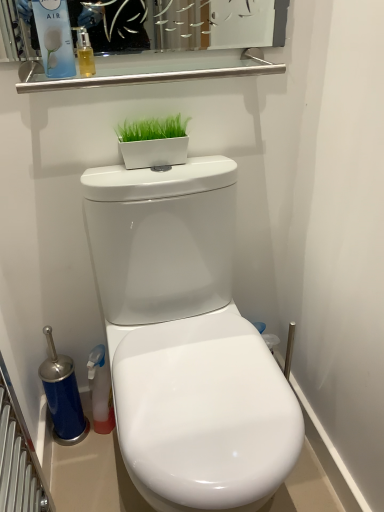
The height and width of the screenshot is (512, 384). What do you see at coordinates (86, 61) in the screenshot?
I see `translucent amber liquid at upper left` at bounding box center [86, 61].

The height and width of the screenshot is (512, 384). What are the coordinates of `satin nickel bar at upper center` in the screenshot? It's located at (152, 69).

Which is more to the left, white glossy toilet at center or white glossy flowerpot at upper center?

white glossy flowerpot at upper center.

Locate an element on the screen. The image size is (384, 512). toilet that appears below the white glossy flowerpot at upper center (from the image's perspective) is located at coordinates (186, 340).

In terms of height, does white glossy toilet at center look taller or shorter compared to white glossy flowerpot at upper center?

Considering their sizes, white glossy toilet at center has more height than white glossy flowerpot at upper center.

In the scene shown: Does white glossy toilet at center have a lesser width compared to translucent amber liquid at upper left?

No.

Does point (292, 452) come in front of point (83, 57)?

Yes, point (292, 452) is closer to viewer.

You are a GUI agent. You are given a task and a screenshot of the screen. Output one action in this format:
    pyautogui.click(x=<x>, y=<y>)
    Task: Click on the liquid above the white glossy toilet at center (from a real-world perspective)
    The height and width of the screenshot is (512, 384).
    Given the screenshot: What is the action you would take?
    pyautogui.click(x=86, y=61)

Considering the positions of objects white glossy toilet at center and translucent amber liquid at upper left in the image provided, who is in front, white glossy toilet at center or translucent amber liquid at upper left?

Positioned in front is white glossy toilet at center.

Which is in front, point (156, 159) or point (50, 73)?

The point (50, 73) is in front.

Is white glossy flowerpot at upper center next to matte blue air freshener at upper left and touching it?

No, white glossy flowerpot at upper center is not touching matte blue air freshener at upper left.

Considering the sizes of objects white glossy flowerpot at upper center and matte blue air freshener at upper left in the image provided, who is smaller, white glossy flowerpot at upper center or matte blue air freshener at upper left?

white glossy flowerpot at upper center.

From a real-world perspective, is matte blue air freshener at upper left located higher than white glossy flowerpot at upper center?

Correct, in the physical world, matte blue air freshener at upper left is higher than white glossy flowerpot at upper center.

Who is bigger, matte blue air freshener at upper left or white glossy flowerpot at upper center?

matte blue air freshener at upper left is bigger.

Is matte blue air freshener at upper left completely or partially outside of white glossy flowerpot at upper center?

Yes.

Considering the sizes of objects white glossy flowerpot at upper center and white glossy toilet at center in the image provided, who is smaller, white glossy flowerpot at upper center or white glossy toilet at center?

white glossy flowerpot at upper center.

Based on the photo, from the image's perspective, is white glossy flowerpot at upper center above or below white glossy toilet at center?

Based on their image positions, white glossy flowerpot at upper center is located above white glossy toilet at center.

Is white glossy flowerpot at upper center in contact with white glossy toilet at center?

They are not placed beside each other.

Considering the positions of objects white glossy flowerpot at upper center and white glossy toilet at center in the image provided, who is behind, white glossy flowerpot at upper center or white glossy toilet at center?

white glossy flowerpot at upper center is more distant.

Can you confirm if matte blue air freshener at upper left is positioned to the left of satin nickel bar at upper center?

Yes, matte blue air freshener at upper left is to the left of satin nickel bar at upper center.

Where is `balustrade directly beneath the matte blue air freshener at upper left (from a real-world perspective)`? The width and height of the screenshot is (384, 512). balustrade directly beneath the matte blue air freshener at upper left (from a real-world perspective) is located at coordinates (152, 69).

Can you confirm if matte blue air freshener at upper left is taller than satin nickel bar at upper center?

Yes.

Between satin nickel bar at upper center and translucent amber liquid at upper left, which one has smaller width?

translucent amber liquid at upper left.

Which object is positioned more to the left, satin nickel bar at upper center or translucent amber liquid at upper left?

Positioned to the left is translucent amber liquid at upper left.

Considering the relative sizes of satin nickel bar at upper center and translucent amber liquid at upper left in the image provided, is satin nickel bar at upper center taller than translucent amber liquid at upper left?

No.

Is point (191, 62) positioned before point (86, 73)?

No, (191, 62) is behind (86, 73).

In order to click on toilet in front of the white glossy flowerpot at upper center in this screenshot , I will do tap(186, 340).

The image size is (384, 512). Find the location of `liquid behind the white glossy toilet at center`. liquid behind the white glossy toilet at center is located at coordinates (86, 61).

Which object lies nearer to the anchor point white glossy flowerpot at upper center, translucent amber liquid at upper left or satin nickel bar at upper center?

Based on the image, satin nickel bar at upper center appears to be nearer to white glossy flowerpot at upper center.

From the image, which object appears to be nearer to white glossy flowerpot at upper center, satin nickel bar at upper center or white glossy toilet at center?

satin nickel bar at upper center is closer to white glossy flowerpot at upper center.

Looking at the image, which one is located closer to white glossy toilet at center, matte blue air freshener at upper left or satin nickel bar at upper center?

Among the two, satin nickel bar at upper center is located nearer to white glossy toilet at center.

Which object lies further to the anchor point satin nickel bar at upper center, matte blue air freshener at upper left or translucent amber liquid at upper left?

Among the two, matte blue air freshener at upper left is located further to satin nickel bar at upper center.

Based on their spatial positions, is satin nickel bar at upper center or translucent amber liquid at upper left further from white glossy flowerpot at upper center?

Among the two, translucent amber liquid at upper left is located further to white glossy flowerpot at upper center.

From the image, which object appears to be nearer to satin nickel bar at upper center, translucent amber liquid at upper left or matte blue air freshener at upper left?

Among the two, translucent amber liquid at upper left is located nearer to satin nickel bar at upper center.

Estimate the real-world distances between objects in this image. Which object is further from white glossy flowerpot at upper center, satin nickel bar at upper center or matte blue air freshener at upper left?

matte blue air freshener at upper left is further to white glossy flowerpot at upper center.

Based on their spatial positions, is white glossy toilet at center or white glossy flowerpot at upper center closer to matte blue air freshener at upper left?

The object closer to matte blue air freshener at upper left is white glossy flowerpot at upper center.

At what (x,y) coordinates should I click in order to perform the action: click on liquid between matte blue air freshener at upper left and satin nickel bar at upper center. Please return your answer as a coordinate pair (x, y). The width and height of the screenshot is (384, 512). Looking at the image, I should click on (86, 61).

You are a GUI agent. You are given a task and a screenshot of the screen. Output one action in this format:
    pyautogui.click(x=<x>, y=<y>)
    Task: Click on the liquid between matte blue air freshener at upper left and white glossy toilet at center in the up-down direction
    Image resolution: width=384 pixels, height=512 pixels.
    Given the screenshot: What is the action you would take?
    pyautogui.click(x=86, y=61)

The height and width of the screenshot is (512, 384). In order to click on balustrade between matte blue air freshener at upper left and white glossy flowerpot at upper center in the front-back direction in this screenshot , I will do `click(152, 69)`.

Identify the location of flowerpot between satin nickel bar at upper center and white glossy toilet at center in the up-down direction. The height and width of the screenshot is (512, 384). (154, 152).